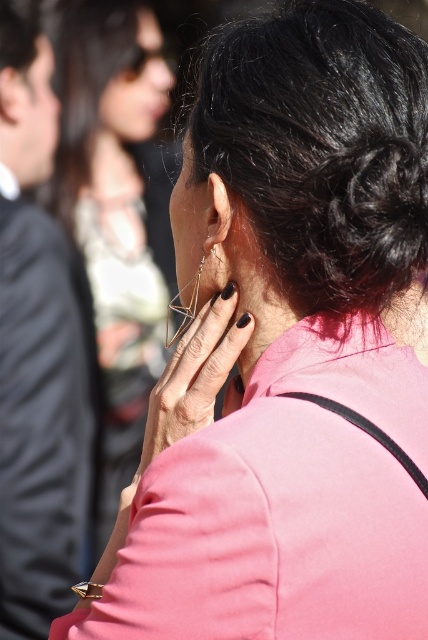
You are a photographer adjusting your camera to focus on the person in the image. You notice two points marked as point (223, 346) and point (214, 243). Which point should you prioritize focusing on to ensure the subject is sharp?

Point (223, 346) should be prioritized for focusing because it is in front of point (214, 243), making it closer to the camera and thus more critical for sharpness.

You are a photographer trying to capture a close detail shot of the person in the image. You need to focus on the pink matte jacket at center and the matte silver earring at center. According to the scene, which object should you adjust your camera to focus on first if you want to capture both in one shot without moving the camera?

The pink matte jacket at center is to the left of the matte silver earring at center, so you should focus on the pink matte jacket at center first as it is closer to the left side, allowing both objects to remain in the frame without needing to reposition the camera.

You are a photographer adjusting the camera focus. You notice the gold metallic ring at center and the matte silver earring at center in the frame. Which object should you focus on first if you want to capture the one closer to the camera?

The gold metallic ring at center is to the left of the matte silver earring at center, but since they are both at the center, their distance from the camera is the same. Therefore, both are equally close and you can focus on either one first.